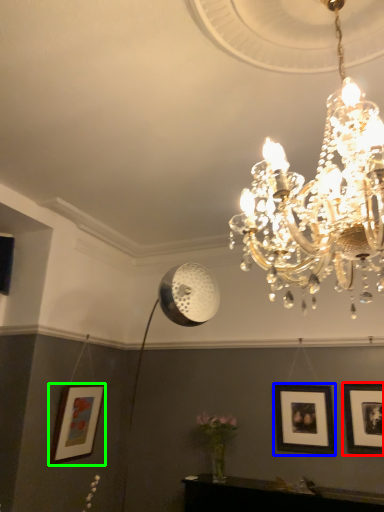
Question: Which object is positioned farthest from picture frame (highlighted by a red box)? Select from picture frame (highlighted by a blue box) and picture frame (highlighted by a green box).

Choices:
 (A) picture frame
 (B) picture frame

Answer: (B)